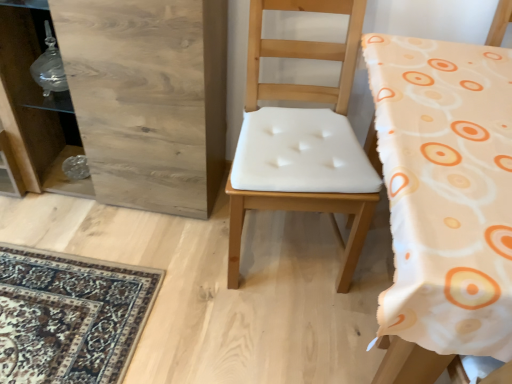
Question: From the image's perspective, is white fabric chair at center, which is the 2th chair in left-to-right order, above or below white fabric chair at center, which ranks as the first chair in left-to-right order?

Choices:
 (A) below
 (B) above

Answer: (A)

Question: From a real-world perspective, is white fabric chair at center, which is the 2th chair in left-to-right order, physically located above or below white fabric chair at center, which ranks as the first chair in left-to-right order?

Choices:
 (A) below
 (B) above

Answer: (B)

Question: Based on their relative distances, which object is farther from the white fabric chair at center, arranged as the second chair when viewed from the right?

Choices:
 (A) white fabric chair at center, the 1th chair viewed from the right
 (B) wooden dresser at left

Answer: (A)

Question: Estimate the real-world distances between objects in this image. Which object is closer to the white fabric chair at center, the 1th chair viewed from the right?

Choices:
 (A) white fabric chair at center, arranged as the second chair when viewed from the right
 (B) wooden dresser at left

Answer: (A)